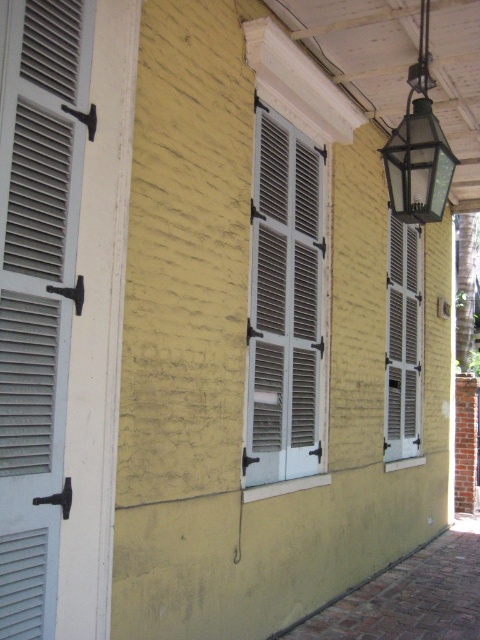
Between white matte shutter at center and clear glass lantern at upper right, which one appears on the left side from the viewer's perspective?

From the viewer's perspective, clear glass lantern at upper right appears more on the left side.

Can you confirm if white matte shutter at center is positioned below clear glass lantern at upper right?

Indeed, white matte shutter at center is positioned under clear glass lantern at upper right.

Which is behind, point (410, 388) or point (425, 177)?

The point (410, 388) is behind.

Locate an element on the screen. Image resolution: width=480 pixels, height=640 pixels. white matte shutter at center is located at coordinates (403, 342).

Which is below, white matte shutters at left or white matte shutters at center?

white matte shutters at left is lower down.

Can you confirm if white matte shutters at left is shorter than white matte shutters at center?

Indeed, white matte shutters at left has a lesser height compared to white matte shutters at center.

Is point (8, 406) in front of point (320, 278)?

Yes, it is.

You are a GUI agent. You are given a task and a screenshot of the screen. Output one action in this format:
    pyautogui.click(x=<x>, y=<y>)
    Task: Click on the white matte shutters at left
    
    Given the screenshot: What is the action you would take?
    pyautogui.click(x=36, y=289)

Describe the element at coordinates (284, 305) in the screenshot. The image size is (480, 640). I see `white matte shutters at center` at that location.

Is point (255, 99) positioned in front of point (444, 196)?

That is False.

This screenshot has width=480, height=640. What do you see at coordinates (284, 305) in the screenshot? I see `white matte shutters at center` at bounding box center [284, 305].

Where is `white matte shutters at center`? The height and width of the screenshot is (640, 480). white matte shutters at center is located at coordinates (284, 305).